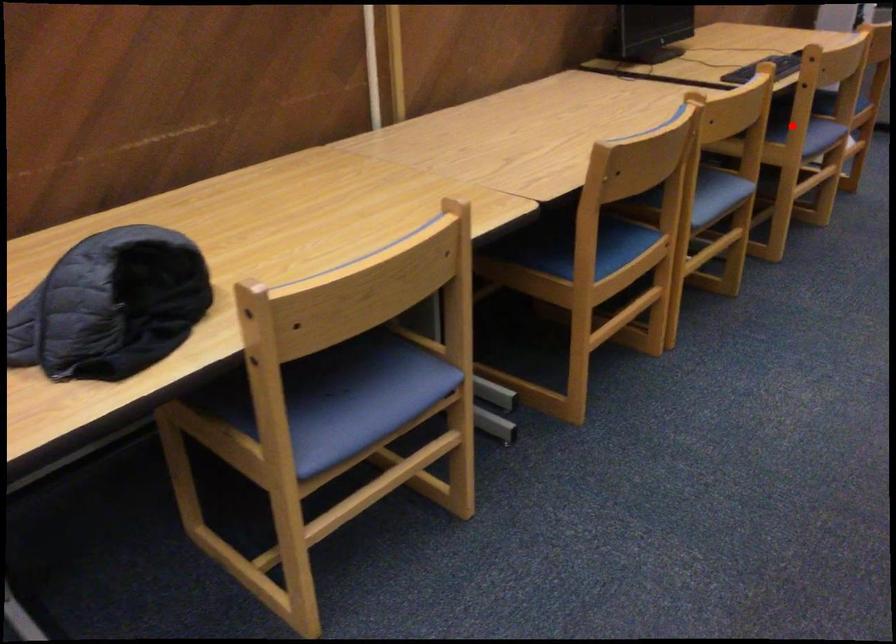
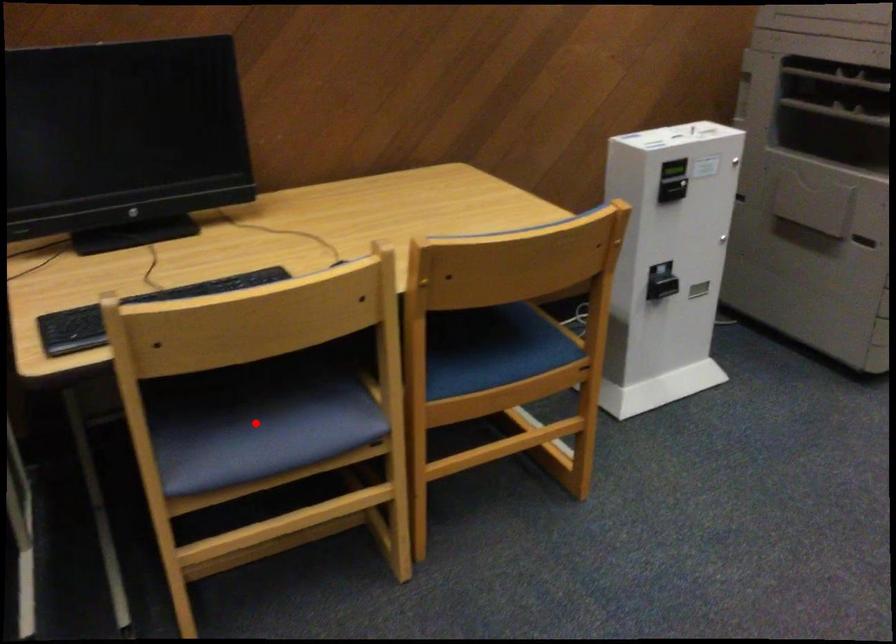
I am providing you with two images of the same scene from different viewpoints. A red point is marked on the first image and another point is marked on the second image. Is the red point in image1 aligned with the point shown in image2?

Yes